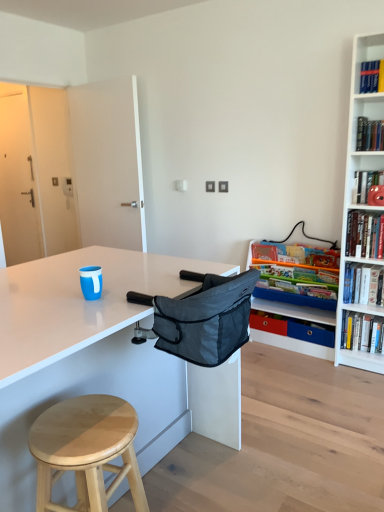
Question: From the image's perspective, is light wood stool at lower left located above or below hardcover book at upper right, marked as the fourth book in a top-to-bottom arrangement?

Choices:
 (A) above
 (B) below

Answer: (B)

Question: Is light wood stool at lower left in front of or behind hardcover book at upper right, positioned as the first book in bottom-to-top order, in the image?

Choices:
 (A) behind
 (B) front

Answer: (B)

Question: Which of these objects is positioned farthest from the matte plastic shelf at right?

Choices:
 (A) red plastic drawer at lower right
 (B) hardcover book at right, acting as the 2th book starting from the top
 (C) light wood stool at lower left
 (D) hardcover book at upper right, the second book when ordered from bottom to top
 (E) dark gray fabric folding chair at center

Answer: (C)

Question: Which object is the farthest from the light wood stool at lower left?

Choices:
 (A) matte plastic shelf at right
 (B) hardcover book at upper right, marked as the fourth book in a top-to-bottom arrangement
 (C) hardcover book at upper right, arranged as the fourth book when ordered from the bottom
 (D) dark gray fabric folding chair at center
 (E) hardcover book at upper right, the second book when ordered from bottom to top

Answer: (C)